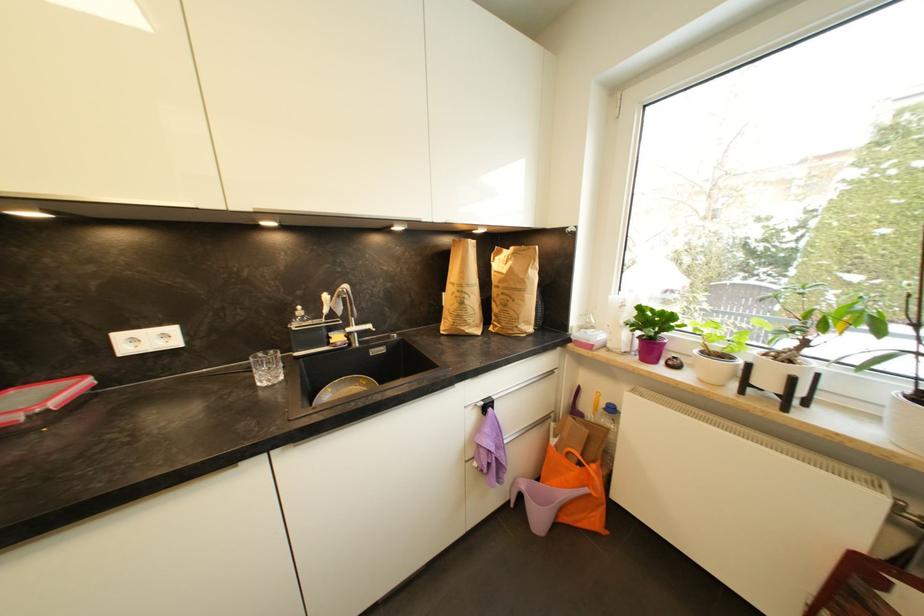
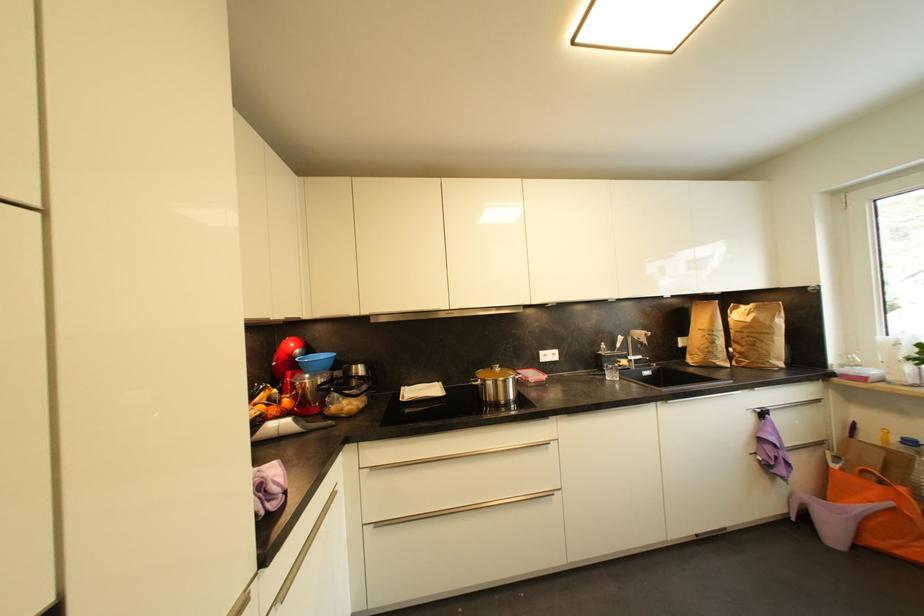
Where in the second image is the point corresponding to the point at 55,381 from the first image?

(528, 371)